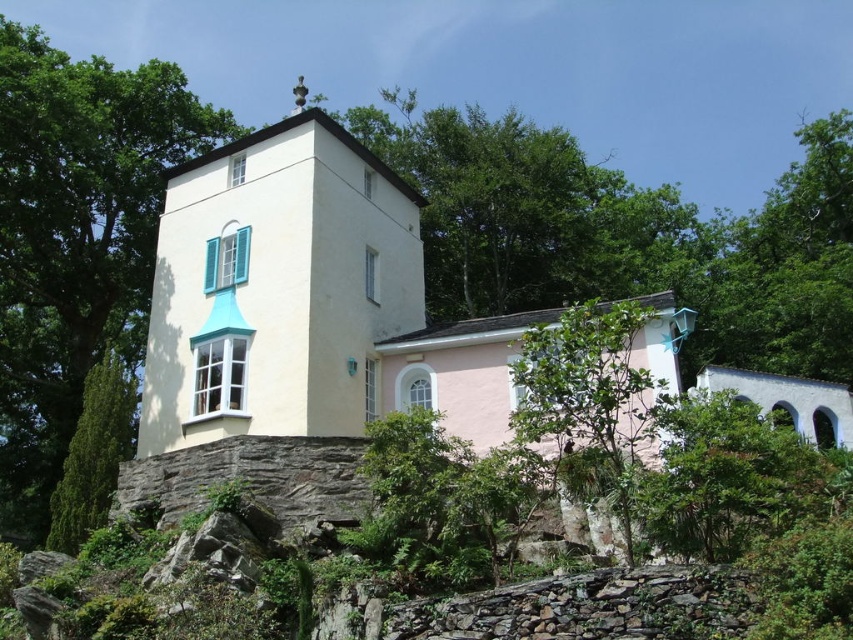
Which of these two, green leafy tree at left or green leafy tree at center, stands shorter?

green leafy tree at center is shorter.

Is point (222, 134) less distant than point (514, 412)?

No.

Identify the location of green leafy tree at left. coord(76,237).

Is white smooth stone chapel at center smaller than green leafy tree at center?

Incorrect, white smooth stone chapel at center is not smaller in size than green leafy tree at center.

Does white smooth stone chapel at center come behind green leafy tree at center?

That is True.

Does point (210, 387) come behind point (608, 312)?

No, it is not.

Identify the location of white smooth stone chapel at center. This screenshot has height=640, width=853. (306, 300).

In the scene shown: Does green leafy tree at left appear on the left side of green leafy tree at lower left?

Correct, you'll find green leafy tree at left to the left of green leafy tree at lower left.

Consider the image. Can you confirm if green leafy tree at left is shorter than green leafy tree at lower left?

In fact, green leafy tree at left may be taller than green leafy tree at lower left.

Is point (105, 100) farther from camera compared to point (88, 509)?

Yes, point (105, 100) is behind point (88, 509).

Locate an element on the screen. This screenshot has height=640, width=853. green leafy tree at left is located at coordinates (76, 237).